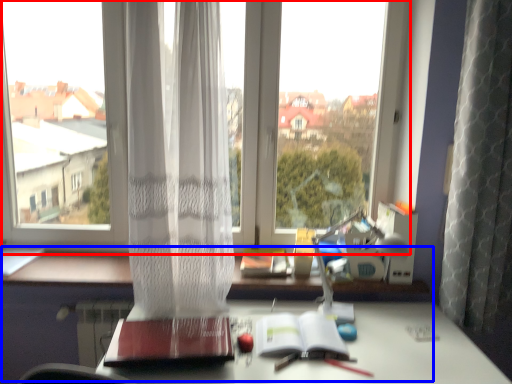
Question: Which object appears farthest to the camera in this image, window (highlighted by a red box) or computer desk (highlighted by a blue box)?

Choices:
 (A) window
 (B) computer desk

Answer: (A)